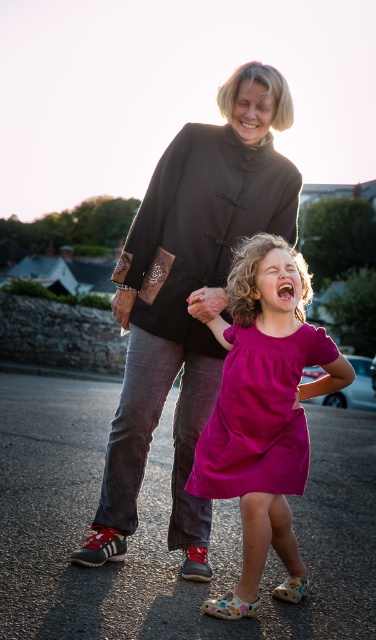
Question: Can you confirm if black cotton sweater at upper center is bigger than pink fabric dress at center?

Choices:
 (A) no
 (B) yes

Answer: (B)

Question: Observing the image, what is the correct spatial positioning of black cotton sweater at upper center in reference to pink fabric dress at center?

Choices:
 (A) below
 (B) above

Answer: (B)

Question: Can you confirm if black cotton sweater at upper center is positioned above pink fabric dress at center?

Choices:
 (A) yes
 (B) no

Answer: (A)

Question: Which object appears farthest from the camera in this image?

Choices:
 (A) black cotton sweater at upper center
 (B) pink fabric dress at center

Answer: (A)